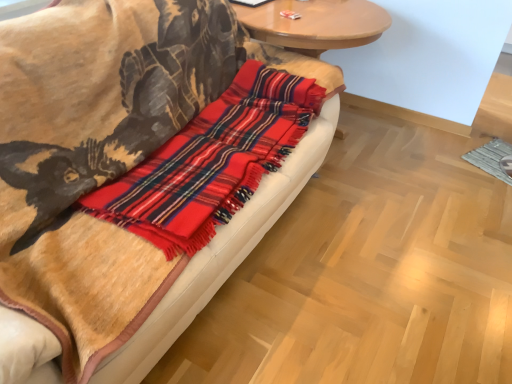
Question: Can you confirm if red plaid flannel at center is wider than plaid wool blanket at center?

Choices:
 (A) no
 (B) yes

Answer: (A)

Question: Does red plaid flannel at center come behind plaid wool blanket at center?

Choices:
 (A) yes
 (B) no

Answer: (A)

Question: Can you confirm if red plaid flannel at center is shorter than plaid wool blanket at center?

Choices:
 (A) yes
 (B) no

Answer: (A)

Question: From the image's perspective, is red plaid flannel at center located above plaid wool blanket at center?

Choices:
 (A) no
 (B) yes

Answer: (B)

Question: Considering the relative sizes of red plaid flannel at center and plaid wool blanket at center in the image provided, is red plaid flannel at center bigger than plaid wool blanket at center?

Choices:
 (A) no
 (B) yes

Answer: (A)

Question: Is red plaid flannel at center not within plaid wool blanket at center?

Choices:
 (A) yes
 (B) no

Answer: (B)

Question: Can you see wooden round table at upper center touching plaid wool blanket at center?

Choices:
 (A) yes
 (B) no

Answer: (B)

Question: Considering the relative sizes of wooden round table at upper center and plaid wool blanket at center in the image provided, is wooden round table at upper center shorter than plaid wool blanket at center?

Choices:
 (A) no
 (B) yes

Answer: (B)

Question: Is plaid wool blanket at center completely or partially inside wooden round table at upper center?

Choices:
 (A) no
 (B) yes

Answer: (A)

Question: Does wooden round table at upper center come behind plaid wool blanket at center?

Choices:
 (A) yes
 (B) no

Answer: (A)

Question: From the image's perspective, would you say wooden round table at upper center is positioned over plaid wool blanket at center?

Choices:
 (A) yes
 (B) no

Answer: (A)

Question: Is plaid wool blanket at center at the back of wooden round table at upper center?

Choices:
 (A) no
 (B) yes

Answer: (A)

Question: Is plaid wool blanket at center closer to the viewer compared to red plaid flannel at center?

Choices:
 (A) yes
 (B) no

Answer: (A)